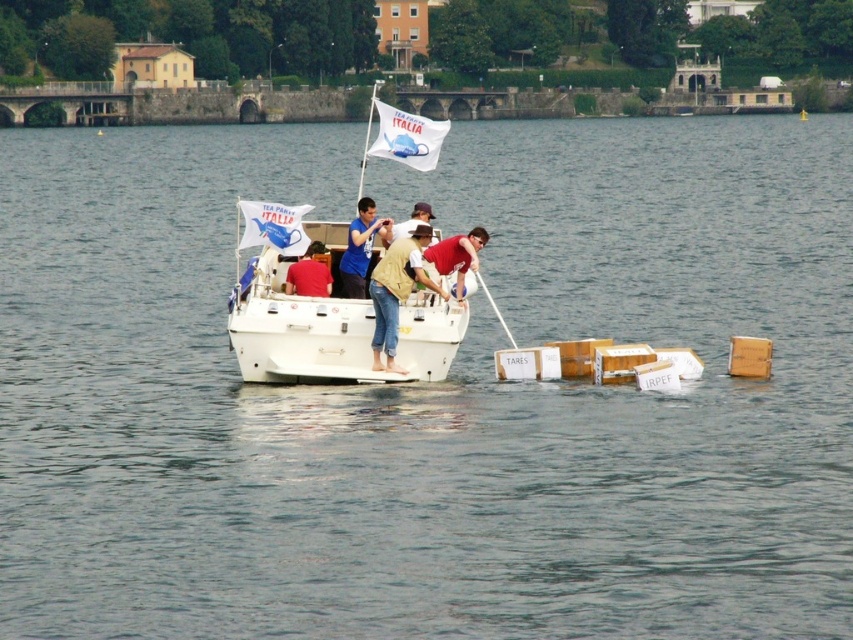
You are a photographer on the blue fabric boat at center. You want to take a photo of the blue fabric shirt at center without the blue fabric flag at center blocking the view. Can you move the flag to the side to achieve this?

The blue fabric flag at center is in front of the blue fabric shirt at center, so moving the flag to the side would allow the blue fabric shirt at center to be visible without obstruction.

You are a photographer on the boat and need to capture both the blue fabric flag at center and the matte red shirt at center in your shot. Which object is taller so you can adjust your camera angle accordingly?

The blue fabric flag at center is taller than the matte red shirt at center, so you should adjust your camera angle to account for its greater height.